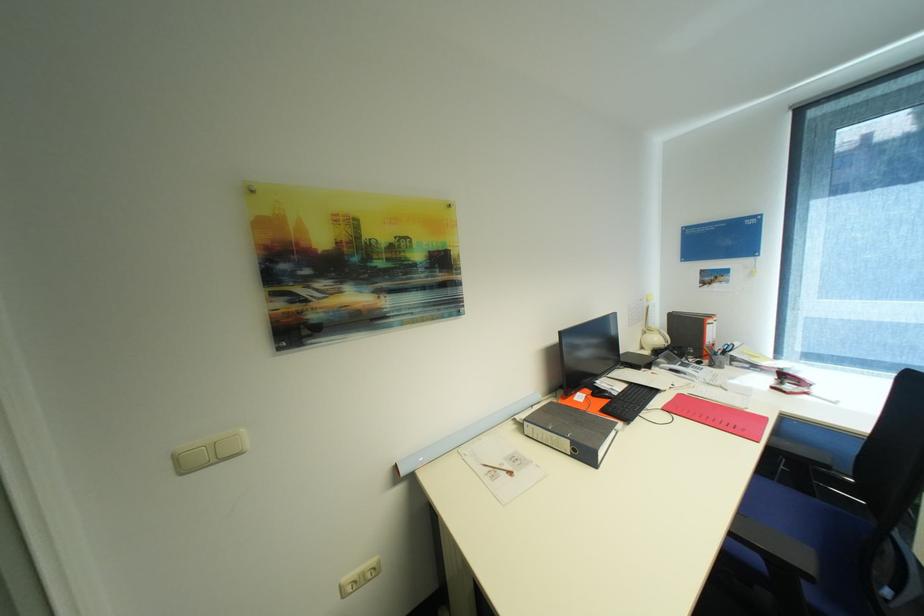
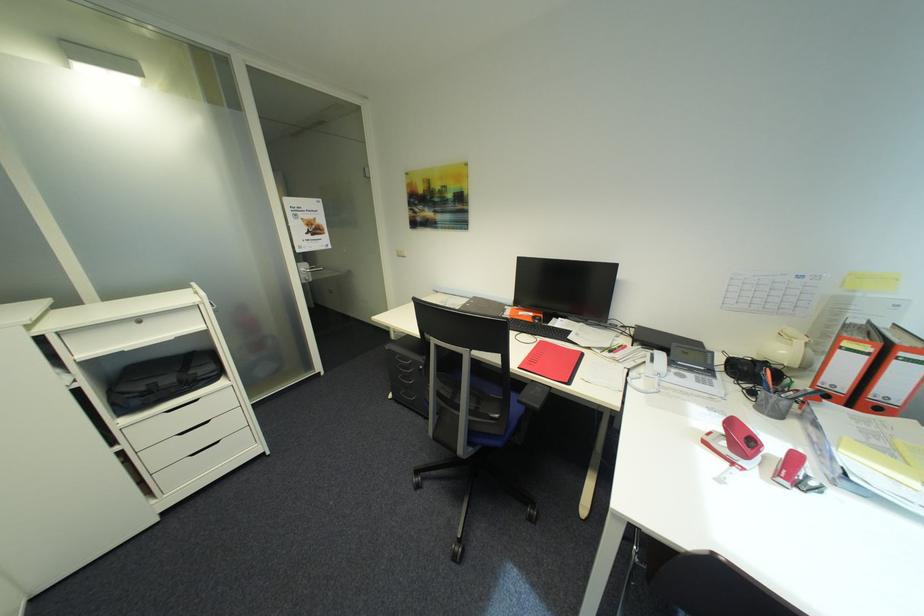
In the second image, find the point that corresponds to [804,389] in the first image.

(730, 447)